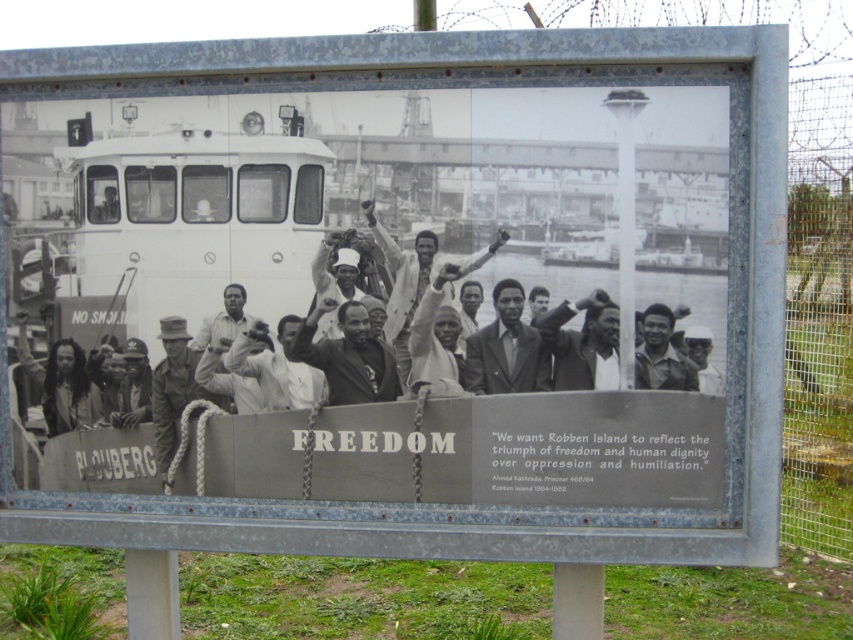
Between dark skin smooth face at center and smooth skin man at center, which one appears on the left side from the viewer's perspective?

smooth skin man at center

Does dark skin smooth face at center come in front of smooth skin man at center?

Yes.

This screenshot has height=640, width=853. Find the location of `dark skin smooth face at center`. dark skin smooth face at center is located at coordinates (660, 355).

Between matte black shirt at center and smooth white shirt at center, which one is positioned lower?

matte black shirt at center is below.

At what (x,y) coordinates should I click in order to perform the action: click on matte black shirt at center. Please return your answer as a coordinate pair (x, y). Image resolution: width=853 pixels, height=640 pixels. Looking at the image, I should click on (583, 342).

Is point (560, 376) more distant than point (335, 330)?

No, (560, 376) is closer to viewer.

Identify the location of matte black shirt at center. (583, 342).

Does light gray suit at center have a greater width compared to smooth skin face at center?

Yes.

Describe the element at coordinates (402, 276) in the screenshot. I see `light gray suit at center` at that location.

Where is `light gray suit at center`? This screenshot has height=640, width=853. light gray suit at center is located at coordinates (402, 276).